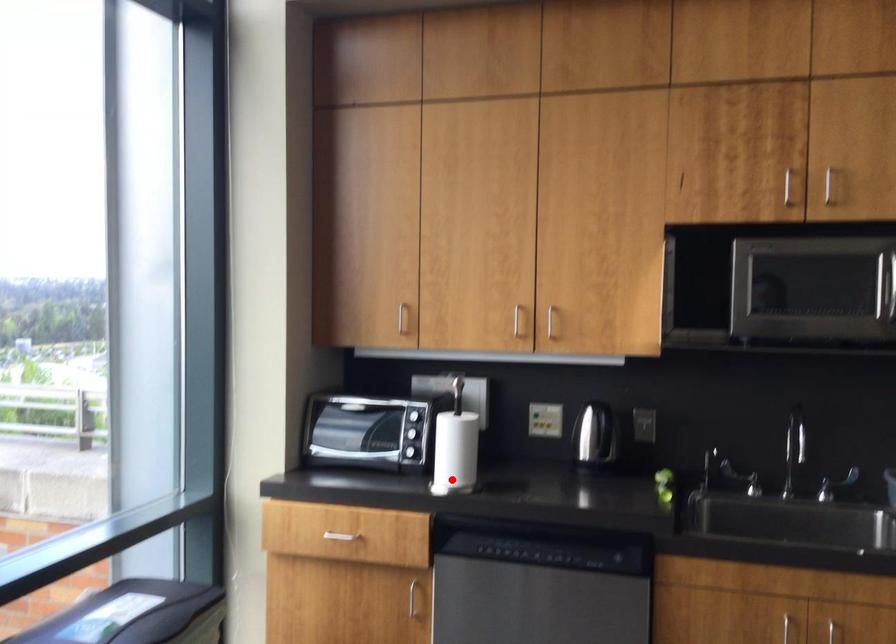
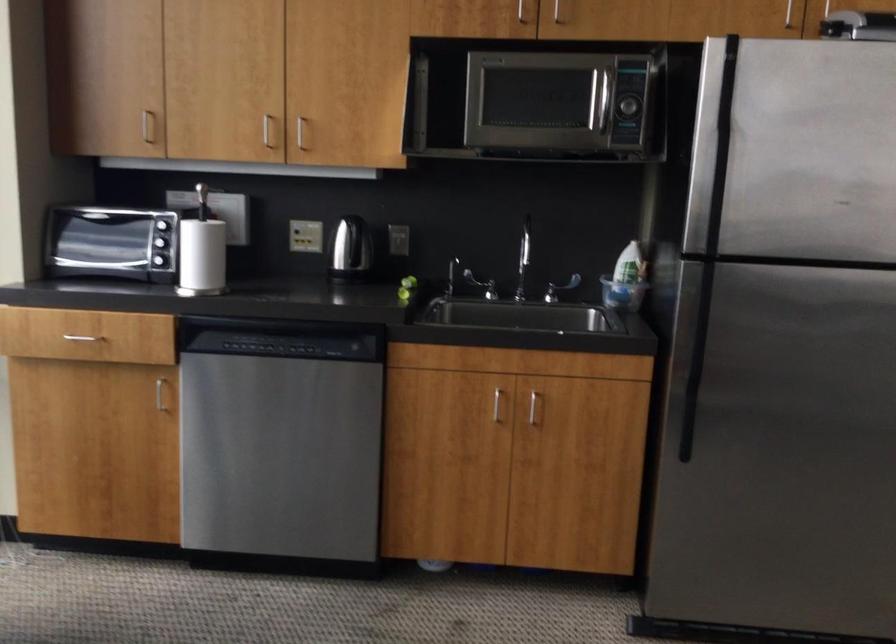
Find the pixel in the second image that matches the highlighted location in the first image.

(202, 281)